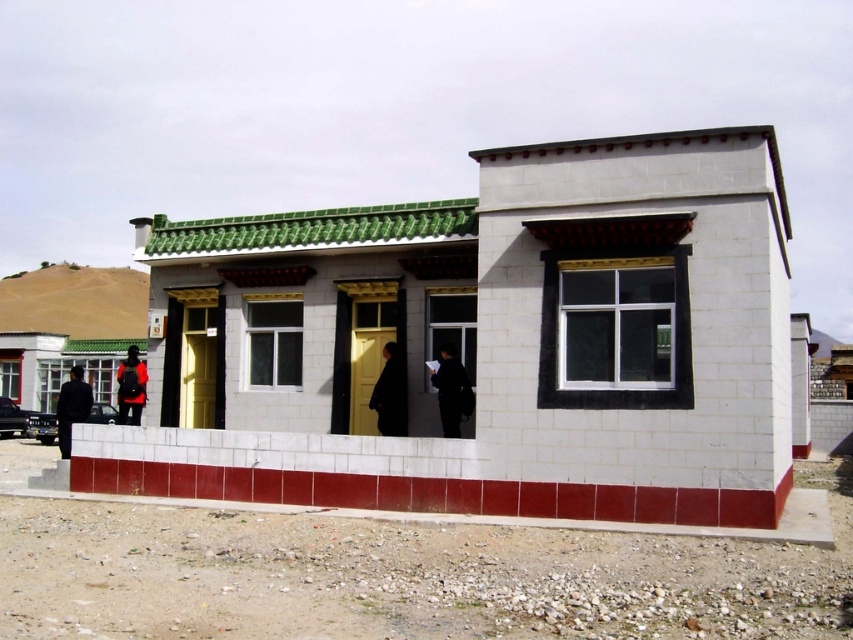
Question: Can you confirm if black matte jacket at center is positioned to the right of black matte suit at center?

Choices:
 (A) no
 (B) yes

Answer: (B)

Question: Estimate the real-world distances between objects in this image. Which object is closer to the dark blue fabric jacket at left?

Choices:
 (A) matte black backpack at lower left
 (B) black matte suit at center

Answer: (A)

Question: Which of the following is the closest to the observer?

Choices:
 (A) (399, 353)
 (B) (463, 401)
 (C) (136, 369)
 (D) (73, 401)

Answer: (B)

Question: Does black matte jacket at center have a lesser width compared to matte black backpack at lower left?

Choices:
 (A) no
 (B) yes

Answer: (B)

Question: Is black matte suit at center to the right of dark blue fabric jacket at left from the viewer's perspective?

Choices:
 (A) no
 (B) yes

Answer: (B)

Question: Which of the following is the farthest from the observer?

Choices:
 (A) (440, 424)
 (B) (62, 448)
 (C) (117, 380)
 (D) (387, 416)

Answer: (C)